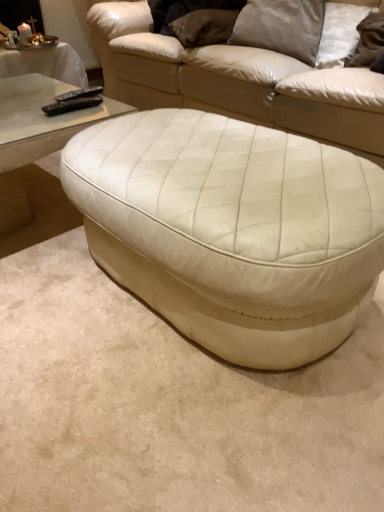
This screenshot has width=384, height=512. I want to click on white leather ottoman at center, so click(232, 230).

What is the approximate width of suede-like brown pillow at upper right, which appears as the third pillow when viewed from the left?

It is 8.84 inches.

Locate an element on the screen. Image resolution: width=384 pixels, height=512 pixels. black plastic remote at upper left, acting as the 2th remote starting from the back is located at coordinates (72, 104).

How much space does black plastic remote at upper left, acting as the 2th remote starting from the back, occupy horizontally?

black plastic remote at upper left, acting as the 2th remote starting from the back, is 2.61 inches in width.

You are a GUI agent. You are given a task and a screenshot of the screen. Output one action in this format:
    pyautogui.click(x=<x>, y=<y>)
    Task: Click on the white leather studio couch at center
    
    Given the screenshot: What is the action you would take?
    pyautogui.click(x=234, y=81)

Between white leather ottoman at center and suede-like beige pillow at upper center, placed as the 1th pillow when sorted from left to right, which one has smaller width?

With smaller width is suede-like beige pillow at upper center, placed as the 1th pillow when sorted from left to right.

Consider the image. Which of these two, white leather ottoman at center or suede-like beige pillow at upper center, the third pillow viewed from the right, is bigger?

Bigger between the two is white leather ottoman at center.

Is white leather ottoman at center inside the boundaries of suede-like beige pillow at upper center, placed as the 1th pillow when sorted from left to right, or outside?

white leather ottoman at center is not enclosed by suede-like beige pillow at upper center, placed as the 1th pillow when sorted from left to right.

Is black plastic remote at upper left, the first remote when ordered from front to back, closer to the viewer compared to suede-like beige pillow at upper center, placed as the 1th pillow when sorted from left to right?

Yes, black plastic remote at upper left, the first remote when ordered from front to back, is closer to the viewer.

Considering the sizes of black plastic remote at upper left, acting as the 2th remote starting from the back, and suede-like beige pillow at upper center, placed as the 1th pillow when sorted from left to right, in the image, is black plastic remote at upper left, acting as the 2th remote starting from the back, wider or thinner than suede-like beige pillow at upper center, placed as the 1th pillow when sorted from left to right,?

Considering their sizes, black plastic remote at upper left, acting as the 2th remote starting from the back, looks slimmer than suede-like beige pillow at upper center, placed as the 1th pillow when sorted from left to right.

Is black plastic remote at upper left, acting as the 2th remote starting from the back, inside the boundaries of suede-like beige pillow at upper center, the third pillow viewed from the right, or outside?

black plastic remote at upper left, acting as the 2th remote starting from the back, lies outside suede-like beige pillow at upper center, the third pillow viewed from the right.

Visually, is black plastic remote at upper left, acting as the 2th remote starting from the back, positioned to the left or to the right of suede-like beige pillow at upper center, placed as the 1th pillow when sorted from left to right?

From the image, it's evident that black plastic remote at upper left, acting as the 2th remote starting from the back, is to the left of suede-like beige pillow at upper center, placed as the 1th pillow when sorted from left to right.

Is suede-like beige pillow at upper center, placed as the 1th pillow when sorted from left to right, completely or partially outside of white leather studio couch at center?

No, suede-like beige pillow at upper center, placed as the 1th pillow when sorted from left to right, is not entirely external to white leather studio couch at center.

From a real-world perspective, is suede-like beige pillow at upper center, the third pillow viewed from the right, above or below white leather studio couch at center?

suede-like beige pillow at upper center, the third pillow viewed from the right, is situated higher than white leather studio couch at center in the real world.

Considering the relative positions of suede-like beige pillow at upper center, the third pillow viewed from the right, and white leather studio couch at center in the image provided, is suede-like beige pillow at upper center, the third pillow viewed from the right, in front of white leather studio couch at center?

No, suede-like beige pillow at upper center, the third pillow viewed from the right, is further to the viewer.

Could you tell me if suede-like beige pillow at upper center, placed as the 1th pillow when sorted from left to right, is facing white leather studio couch at center?

Yes.

Looking at this image, in terms of size, does suede-like beige pillow at upper center, the third pillow viewed from the right, appear bigger or smaller than black plastic remote at upper left, the first remote when ordered from front to back?

In the image, suede-like beige pillow at upper center, the third pillow viewed from the right, appears to be larger than black plastic remote at upper left, the first remote when ordered from front to back.

Where is `the 3rd pillow above the black plastic remote at upper left, the first remote when ordered from front to back (from the image's perspective)`? This screenshot has width=384, height=512. the 3rd pillow above the black plastic remote at upper left, the first remote when ordered from front to back (from the image's perspective) is located at coordinates (204, 27).

Is suede-like beige pillow at upper center, placed as the 1th pillow when sorted from left to right, looking in the opposite direction of black plastic remote at upper left, acting as the 2th remote starting from the back?

No.

Visually, is suede-like beige pillow at upper center, placed as the 1th pillow when sorted from left to right, positioned to the left or to the right of black plastic remote at upper left, acting as the 2th remote starting from the back?

In the image, suede-like beige pillow at upper center, placed as the 1th pillow when sorted from left to right, appears on the right side of black plastic remote at upper left, acting as the 2th remote starting from the back.

From the image's perspective, which one is positioned higher, suede-like beige pillow at upper center, the third pillow viewed from the right, or black matte remote at upper left, the second remote in the front-to-back sequence?

From the image's view, suede-like beige pillow at upper center, the third pillow viewed from the right, is above.

Considering the positions of points (187, 20) and (66, 100), is point (187, 20) farther from camera compared to point (66, 100)?

Yes.

From the picture: Looking at the image, does white leather ottoman at center seem bigger or smaller compared to satin gray pillow at upper center, which appears as the 2th pillow when viewed from the right?

Considering their sizes, white leather ottoman at center takes up more space than satin gray pillow at upper center, which appears as the 2th pillow when viewed from the right.

Considering the relative sizes of white leather ottoman at center and satin gray pillow at upper center, placed as the second pillow when sorted from left to right, in the image provided, is white leather ottoman at center shorter than satin gray pillow at upper center, placed as the second pillow when sorted from left to right,?

No, white leather ottoman at center is not shorter than satin gray pillow at upper center, placed as the second pillow when sorted from left to right.

Is white leather ottoman at center looking in the opposite direction of satin gray pillow at upper center, placed as the second pillow when sorted from left to right?

white leather ottoman at center is not turned away from satin gray pillow at upper center, placed as the second pillow when sorted from left to right.

From a real-world perspective, is white leather ottoman at center above or below satin gray pillow at upper center, placed as the second pillow when sorted from left to right?

From a real-world perspective, white leather ottoman at center is physically below satin gray pillow at upper center, placed as the second pillow when sorted from left to right.

From the image's perspective, who appears lower, black matte remote at upper left, the second remote in the front-to-back sequence, or satin gray pillow at upper center, which appears as the 2th pillow when viewed from the right?

black matte remote at upper left, the second remote in the front-to-back sequence.

Is point (62, 101) closer to viewer compared to point (317, 6)?

Yes, point (62, 101) is in front of point (317, 6).

Is black matte remote at upper left, which is the 1th remote in back-to-front order, far away from satin gray pillow at upper center, which appears as the 2th pillow when viewed from the right?

That's not correct — black matte remote at upper left, which is the 1th remote in back-to-front order, is a little close to satin gray pillow at upper center, which appears as the 2th pillow when viewed from the right.

In order to click on table below the suede-like beige pillow at upper center, placed as the 1th pillow when sorted from left to right (from the image's perspective) in this screenshot , I will do `click(232, 230)`.

The height and width of the screenshot is (512, 384). I want to click on remote that is the 2nd one when counting forward from the suede-like beige pillow at upper center, placed as the 1th pillow when sorted from left to right, so click(x=72, y=104).

Which object lies nearer to the anchor point suede-like brown pillow at upper right, which appears as the third pillow when viewed from the left, white leather ottoman at center or satin gray pillow at upper center, which appears as the 2th pillow when viewed from the right?

satin gray pillow at upper center, which appears as the 2th pillow when viewed from the right, is positioned closer to the anchor suede-like brown pillow at upper right, which appears as the third pillow when viewed from the left.

From the image, which object appears to be nearer to suede-like beige pillow at upper center, the third pillow viewed from the right, white leather studio couch at center or white leather ottoman at center?

white leather studio couch at center is closer to suede-like beige pillow at upper center, the third pillow viewed from the right.

Looking at the image, which one is located closer to suede-like beige pillow at upper center, placed as the 1th pillow when sorted from left to right, black plastic remote at upper left, the first remote when ordered from front to back, or white leather ottoman at center?

black plastic remote at upper left, the first remote when ordered from front to back, is positioned closer to the anchor suede-like beige pillow at upper center, placed as the 1th pillow when sorted from left to right.

Which object lies nearer to the anchor point satin gray pillow at upper center, placed as the second pillow when sorted from left to right, suede-like beige pillow at upper center, placed as the 1th pillow when sorted from left to right, or white leather studio couch at center?

The object closer to satin gray pillow at upper center, placed as the second pillow when sorted from left to right, is suede-like beige pillow at upper center, placed as the 1th pillow when sorted from left to right.

Looking at the image, which one is located further to suede-like beige pillow at upper center, placed as the 1th pillow when sorted from left to right, satin gray pillow at upper center, placed as the second pillow when sorted from left to right, or white leather studio couch at center?

white leather studio couch at center is positioned further to the anchor suede-like beige pillow at upper center, placed as the 1th pillow when sorted from left to right.

Estimate the real-world distances between objects in this image. Which object is closer to suede-like beige pillow at upper center, placed as the 1th pillow when sorted from left to right, black matte remote at upper left, the second remote in the front-to-back sequence, or satin gray pillow at upper center, placed as the second pillow when sorted from left to right?

satin gray pillow at upper center, placed as the second pillow when sorted from left to right, is positioned closer to the anchor suede-like beige pillow at upper center, placed as the 1th pillow when sorted from left to right.

From the picture: Which object lies nearer to the anchor point black plastic remote at upper left, the first remote when ordered from front to back, white leather studio couch at center or satin gray pillow at upper center, which appears as the 2th pillow when viewed from the right?

white leather studio couch at center is positioned closer to the anchor black plastic remote at upper left, the first remote when ordered from front to back.

Estimate the real-world distances between objects in this image. Which object is further from black matte remote at upper left, the second remote in the front-to-back sequence, black plastic remote at upper left, the first remote when ordered from front to back, or white leather studio couch at center?

white leather studio couch at center is further to black matte remote at upper left, the second remote in the front-to-back sequence.

At what (x,y) coordinates should I click in order to perform the action: click on studio couch situated between black plastic remote at upper left, acting as the 2th remote starting from the back, and satin gray pillow at upper center, placed as the second pillow when sorted from left to right, from left to right. Please return your answer as a coordinate pair (x, y). This screenshot has height=512, width=384. Looking at the image, I should click on (234, 81).

I want to click on pillow between black matte remote at upper left, which is the 1th remote in back-to-front order, and satin gray pillow at upper center, placed as the second pillow when sorted from left to right, so click(x=204, y=27).

You are a GUI agent. You are given a task and a screenshot of the screen. Output one action in this format:
    pyautogui.click(x=<x>, y=<y>)
    Task: Click on the table situated between black matte remote at upper left, which is the 1th remote in back-to-front order, and suede-like brown pillow at upper right, the first pillow viewed from the right, from left to right
    The height and width of the screenshot is (512, 384).
    Given the screenshot: What is the action you would take?
    pyautogui.click(x=232, y=230)

At what (x,y) coordinates should I click in order to perform the action: click on studio couch between black matte remote at upper left, which is the 1th remote in back-to-front order, and suede-like brown pillow at upper right, which appears as the third pillow when viewed from the left. Please return your answer as a coordinate pair (x, y). The width and height of the screenshot is (384, 512). Looking at the image, I should click on (234, 81).